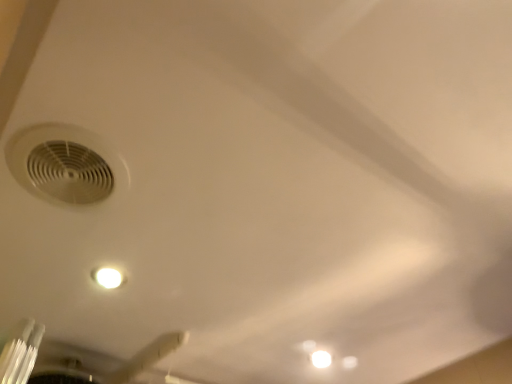
Image resolution: width=512 pixels, height=384 pixels. What are the coordinates of `white matte ceiling fan at lower left` in the screenshot? It's located at (101, 363).

Measure the distance between point (x=174, y=337) and camera.

Point (x=174, y=337) and camera are 1.17 meters apart from each other.

In order to face white matte ceiling fan at lower left, should I rotate leftwards or rightwards?

Rotate your view left by about 23.198°.

The image size is (512, 384). What do you see at coordinates (101, 363) in the screenshot? I see `white matte ceiling fan at lower left` at bounding box center [101, 363].

You are a GUI agent. You are given a task and a screenshot of the screen. Output one action in this format:
    pyautogui.click(x=<x>, y=<y>)
    Task: Click on the white matte air conditioning at upper left
    
    Given the screenshot: What is the action you would take?
    pyautogui.click(x=65, y=164)

Describe the element at coordinates (65, 164) in the screenshot. I see `white matte air conditioning at upper left` at that location.

Find the location of a particular element. white matte ceiling fan at lower left is located at coordinates (101, 363).

Considering the positions of objects white matte ceiling fan at lower left and white matte air conditioning at upper left in the image provided, who is more to the left, white matte ceiling fan at lower left or white matte air conditioning at upper left?

From the viewer's perspective, white matte ceiling fan at lower left appears more on the left side.

Based on the photo, between white matte ceiling fan at lower left and white matte air conditioning at upper left, which one is positioned in front?

white matte air conditioning at upper left is closer to the camera.

Is point (101, 369) closer or farther from the camera than point (49, 162)?

Point (101, 369) appears to be farther away from the viewer than point (49, 162).

From the image's perspective, which object appears higher, white matte ceiling fan at lower left or white matte air conditioning at upper left?

white matte air conditioning at upper left appears higher in the image.

From a real-world perspective, is white matte ceiling fan at lower left physically located above or below white matte air conditioning at upper left?

white matte ceiling fan at lower left is situated lower than white matte air conditioning at upper left in the real world.

Considering the relative sizes of white matte ceiling fan at lower left and white matte air conditioning at upper left in the image provided, is white matte ceiling fan at lower left thinner than white matte air conditioning at upper left?

Incorrect, the width of white matte ceiling fan at lower left is not less than that of white matte air conditioning at upper left.

From the picture: Which of these two, white matte ceiling fan at lower left or white matte air conditioning at upper left, stands taller?

white matte ceiling fan at lower left is taller.

Does white matte ceiling fan at lower left have a larger size compared to white matte air conditioning at upper left?

Indeed, white matte ceiling fan at lower left has a larger size compared to white matte air conditioning at upper left.

Looking at this image, would you say white matte ceiling fan at lower left is inside or outside white matte air conditioning at upper left?

white matte ceiling fan at lower left is outside white matte air conditioning at upper left.

Is white matte ceiling fan at lower left directly adjacent to white matte air conditioning at upper left?

No.

Is white matte ceiling fan at lower left positioned with its back to white matte air conditioning at upper left?

white matte ceiling fan at lower left does not have its back to white matte air conditioning at upper left.

Where is `air conditioning above the white matte ceiling fan at lower left (from a real-world perspective)`? air conditioning above the white matte ceiling fan at lower left (from a real-world perspective) is located at coordinates (65, 164).

Considering the relative positions of white matte air conditioning at upper left and white matte ceiling fan at lower left in the image provided, is white matte air conditioning at upper left to the left of white matte ceiling fan at lower left from the viewer's perspective?

In fact, white matte air conditioning at upper left is to the right of white matte ceiling fan at lower left.

Is the depth of white matte air conditioning at upper left greater than that of white matte ceiling fan at lower left?

No, white matte air conditioning at upper left is closer to the camera.

Is point (98, 185) closer to viewer compared to point (112, 380)?

Yes, it is in front of point (112, 380).

From the image's perspective, is white matte air conditioning at upper left under white matte ceiling fan at lower left?

No, from the image's perspective, white matte air conditioning at upper left is not below white matte ceiling fan at lower left.

From a real-world perspective, relative to white matte ceiling fan at lower left, is white matte air conditioning at upper left vertically above or below?

In terms of real-world spatial position, white matte air conditioning at upper left is above white matte ceiling fan at lower left.

Is white matte air conditioning at upper left thinner than white matte ceiling fan at lower left?

Yes, white matte air conditioning at upper left is thinner than white matte ceiling fan at lower left.

Is white matte air conditioning at upper left taller or shorter than white matte ceiling fan at lower left?

In the image, white matte air conditioning at upper left appears to be shorter than white matte ceiling fan at lower left.

Considering the sizes of objects white matte air conditioning at upper left and white matte ceiling fan at lower left in the image provided, who is bigger, white matte air conditioning at upper left or white matte ceiling fan at lower left?

white matte ceiling fan at lower left is bigger.

Is white matte ceiling fan at lower left surrounded by white matte air conditioning at upper left?

No, white matte ceiling fan at lower left is not a part of white matte air conditioning at upper left.

Is white matte air conditioning at upper left in contact with white matte ceiling fan at lower left?

There is a gap between white matte air conditioning at upper left and white matte ceiling fan at lower left.

Is white matte air conditioning at upper left oriented away from white matte ceiling fan at lower left?

No, white matte air conditioning at upper left is not facing the opposite direction of white matte ceiling fan at lower left.

Can you tell me how much white matte air conditioning at upper left and white matte ceiling fan at lower left differ in facing direction?

The angle between the facing direction of white matte air conditioning at upper left and the facing direction of white matte ceiling fan at lower left is 90 degrees.

Identify the location of air conditioning located above the white matte ceiling fan at lower left (from a real-world perspective). This screenshot has width=512, height=384. (65, 164).

Locate an element on the screen. The height and width of the screenshot is (384, 512). ceiling fan behind the white matte air conditioning at upper left is located at coordinates (101, 363).

At what (x,y) coordinates should I click in order to perform the action: click on air conditioning located in front of the white matte ceiling fan at lower left. Please return your answer as a coordinate pair (x, y). The height and width of the screenshot is (384, 512). Looking at the image, I should click on (65, 164).